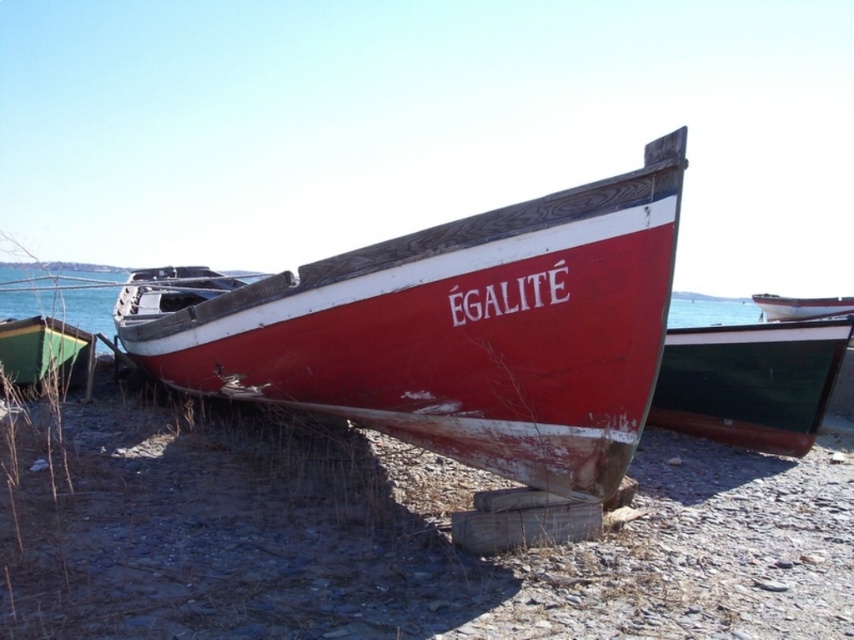
Which is below, dark green polished wood boat at right or white glossy boat at right?

dark green polished wood boat at right is lower down.

The image size is (854, 640). Identify the location of dark green polished wood boat at right. (752, 381).

Locate an element on the screen. dark green polished wood boat at right is located at coordinates (752, 381).

Based on the photo, is rusty wood boat at center taller than white glossy boat at right?

Indeed, rusty wood boat at center has a greater height compared to white glossy boat at right.

Consider the image. Is rusty wood boat at center below white glossy boat at right?

Correct, rusty wood boat at center is located below white glossy boat at right.

Describe the element at coordinates (464, 332) in the screenshot. I see `rusty wood boat at center` at that location.

Image resolution: width=854 pixels, height=640 pixels. I want to click on rusty wood boat at center, so click(464, 332).

At what (x,y) coordinates should I click in order to perform the action: click on dark green polished wood boat at right. Please return your answer as a coordinate pair (x, y). This screenshot has height=640, width=854. Looking at the image, I should click on (752, 381).

Is the position of dark green polished wood boat at right less distant than that of green matte boat at lower left?

Yes, dark green polished wood boat at right is closer to the viewer.

The height and width of the screenshot is (640, 854). Identify the location of dark green polished wood boat at right. (752, 381).